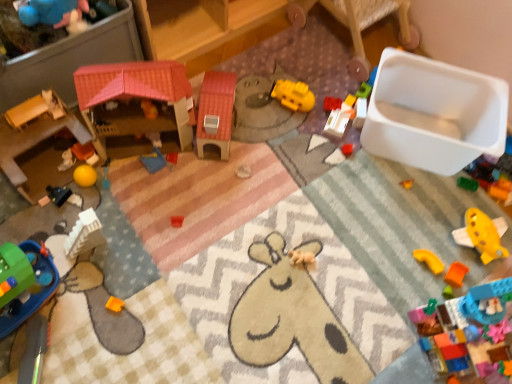
Question: Is green plastic toy at lower left, the fourteenth toy viewed from the right, outside smooth wooden dollhouse at left, placed as the 15th toy when sorted from right to left?

Choices:
 (A) yes
 (B) no

Answer: (A)

Question: Is green plastic toy at lower left, the fourteenth toy viewed from the right, directly adjacent to smooth wooden dollhouse at left, the 1th toy in the left-to-right sequence?

Choices:
 (A) yes
 (B) no

Answer: (B)

Question: Can you confirm if green plastic toy at lower left, the fourteenth toy viewed from the right, is thinner than smooth wooden dollhouse at left, placed as the 15th toy when sorted from right to left?

Choices:
 (A) yes
 (B) no

Answer: (B)

Question: Is green plastic toy at lower left, the fourteenth toy viewed from the right, smaller than smooth wooden dollhouse at left, placed as the 15th toy when sorted from right to left?

Choices:
 (A) no
 (B) yes

Answer: (B)

Question: Considering the relative positions of green plastic toy at lower left, acting as the second toy starting from the left, and smooth wooden dollhouse at left, placed as the 15th toy when sorted from right to left, in the image provided, is green plastic toy at lower left, acting as the second toy starting from the left, to the right of smooth wooden dollhouse at left, placed as the 15th toy when sorted from right to left, from the viewer's perspective?

Choices:
 (A) yes
 (B) no

Answer: (A)

Question: From a real-world perspective, is black plastic toy at lower left, the 13th toy from the right, positioned above or below plastic pink house at center, the 7th toy in the left-to-right sequence?

Choices:
 (A) below
 (B) above

Answer: (A)

Question: Based on their sizes in the image, would you say black plastic toy at lower left, the 13th toy from the right, is bigger or smaller than plastic pink house at center, the 7th toy in the left-to-right sequence?

Choices:
 (A) big
 (B) small

Answer: (B)

Question: From the image's perspective, is black plastic toy at lower left, the 13th toy from the right, located above or below plastic pink house at center, positioned as the 9th toy in right-to-left order?

Choices:
 (A) below
 (B) above

Answer: (A)

Question: Considering the relative positions of black plastic toy at lower left, arranged as the 3th toy when viewed from the left, and plastic pink house at center, the 7th toy in the left-to-right sequence, in the image provided, is black plastic toy at lower left, arranged as the 3th toy when viewed from the left, to the left or to the right of plastic pink house at center, the 7th toy in the left-to-right sequence,?

Choices:
 (A) left
 (B) right

Answer: (A)

Question: Is matte orange blocks at left, the eleventh toy viewed from the right, wider or thinner than blue plastic tray at center, which ranks as the 10th toy in right-to-left order?

Choices:
 (A) wide
 (B) thin

Answer: (A)

Question: Based on their sizes in the image, would you say matte orange blocks at left, positioned as the fifth toy in left-to-right order, is bigger or smaller than blue plastic tray at center, acting as the 6th toy starting from the left?

Choices:
 (A) small
 (B) big

Answer: (A)

Question: Is point (75, 145) positioned closer to the camera than point (162, 165)?

Choices:
 (A) farther
 (B) closer

Answer: (A)

Question: Considering the relative positions of matte orange blocks at left, positioned as the fifth toy in left-to-right order, and blue plastic tray at center, acting as the 6th toy starting from the left, in the image provided, is matte orange blocks at left, positioned as the fifth toy in left-to-right order, to the left or to the right of blue plastic tray at center, acting as the 6th toy starting from the left,?

Choices:
 (A) left
 (B) right

Answer: (A)

Question: Relative to white plastic container at center, acting as the 10th toy starting from the left, is yellow matte plastic arch at lower right, which appears as the twelfth toy when viewed from the left, in front or behind?

Choices:
 (A) behind
 (B) front

Answer: (B)

Question: Based on their sizes in the image, would you say yellow matte plastic arch at lower right, acting as the 4th toy starting from the right, is bigger or smaller than white plastic container at center, marked as the 6th toy in a right-to-left arrangement?

Choices:
 (A) big
 (B) small

Answer: (B)